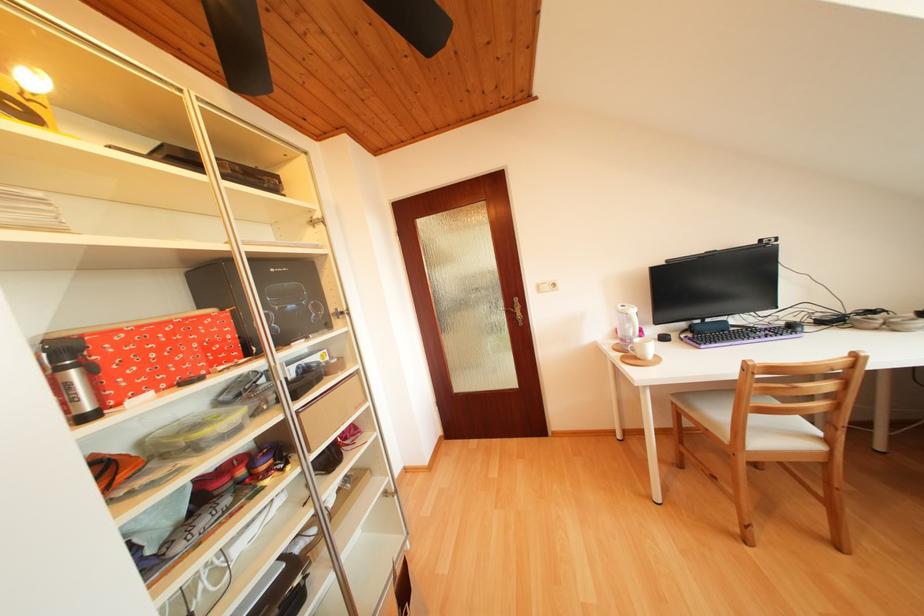
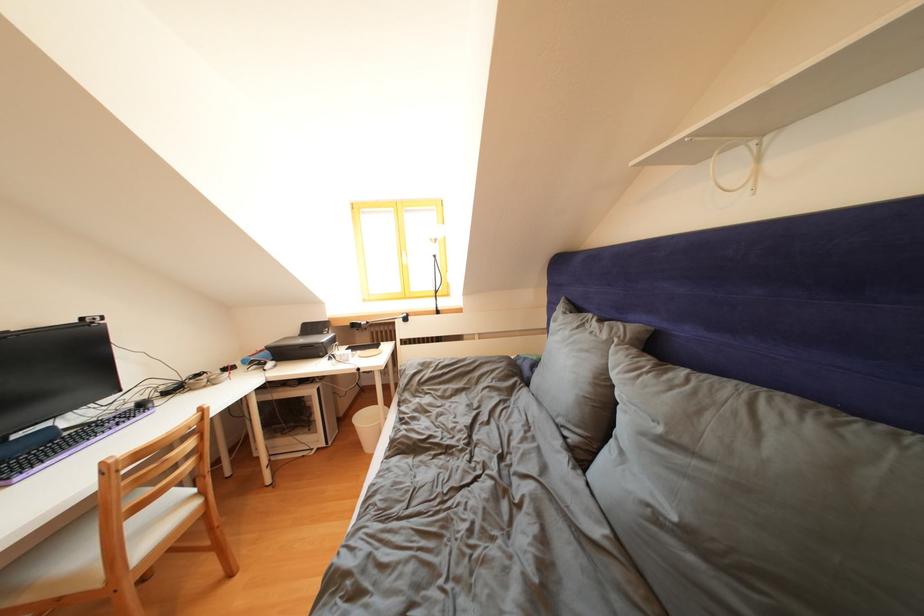
Question: The camera is either moving clockwise (left) or counter-clockwise (right) around the object. The first image is from the beginning of the video and the second image is from the end. Is the camera moving left or right when shooting the video?

Choices:
 (A) Left
 (B) Right

Answer: (A)